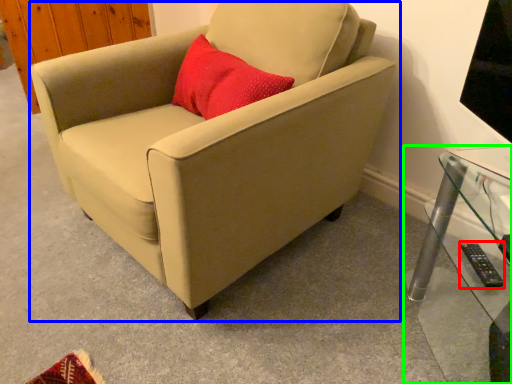
Question: Which object is the closest to the remote (highlighted by a red box)? Choose among these: chair (highlighted by a blue box) or table (highlighted by a green box).

Choices:
 (A) chair
 (B) table

Answer: (B)